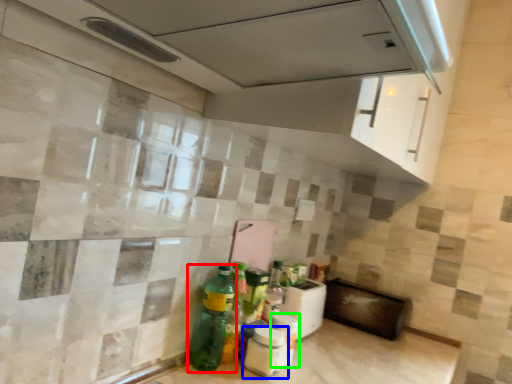
Question: Which object is the farthest from bottle (highlighted by a red box)? Choose among these: bottle (highlighted by a blue box) or bottle (highlighted by a green box).

Choices:
 (A) bottle
 (B) bottle

Answer: (B)